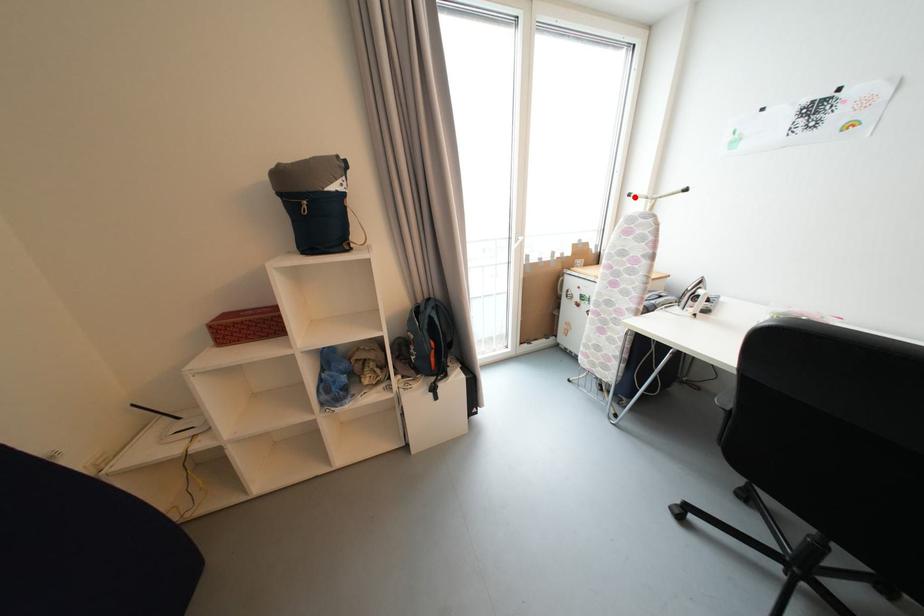
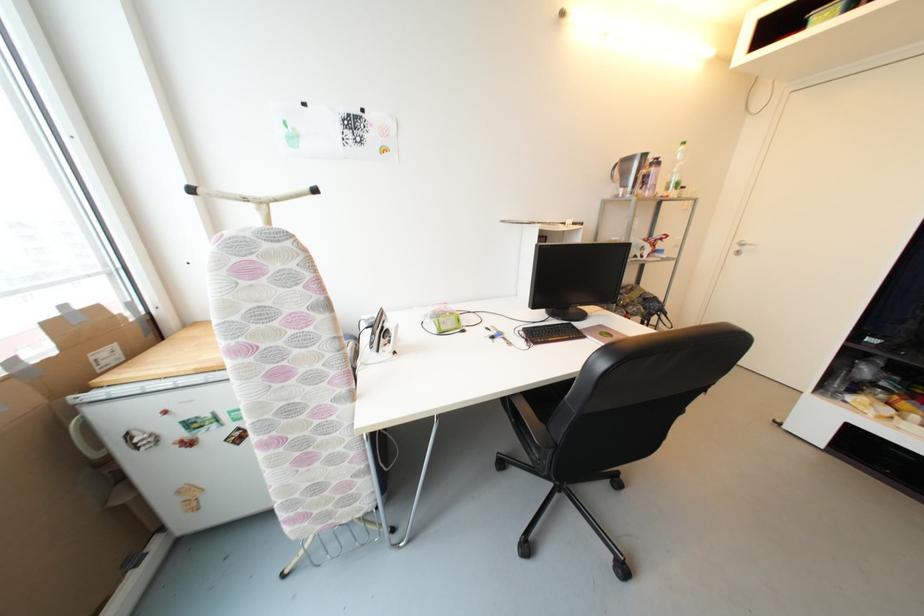
Find the pixel in the second image that matches the highlighted location in the first image.

(197, 192)